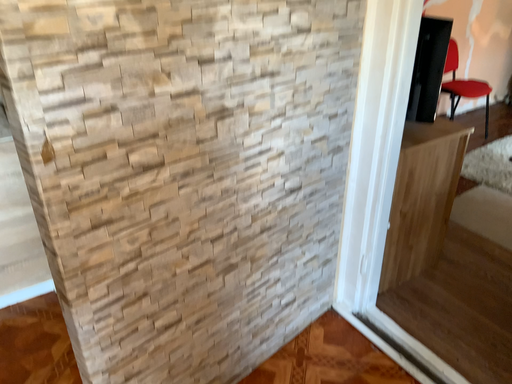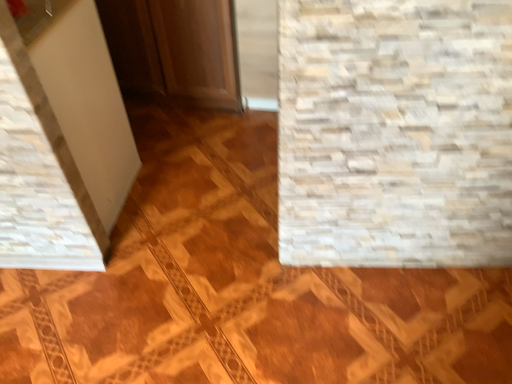
Question: How did the camera likely rotate when shooting the video?

Choices:
 (A) rotated upward
 (B) rotated downward

Answer: (B)